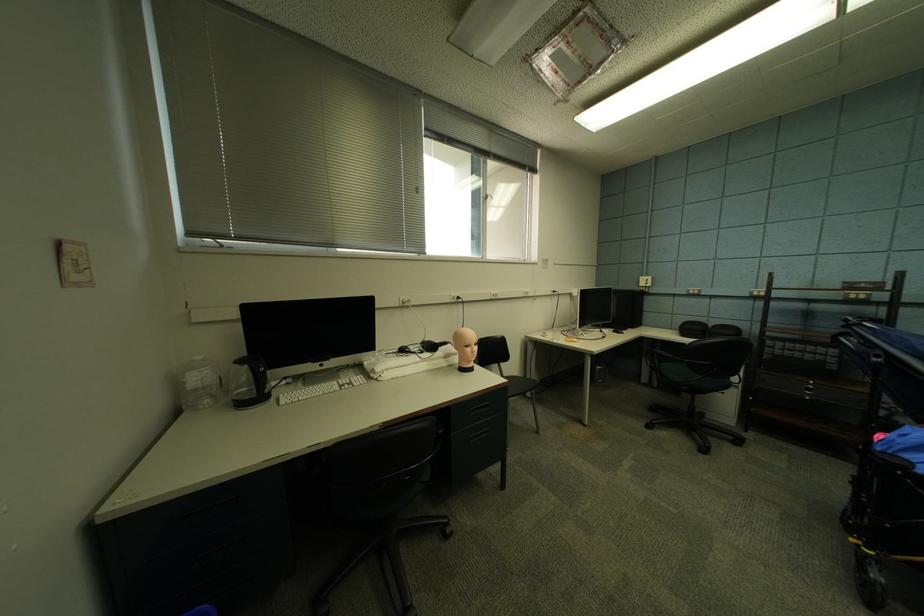
Where is `drawer handle`? Image resolution: width=924 pixels, height=616 pixels. drawer handle is located at coordinates pos(483,429).